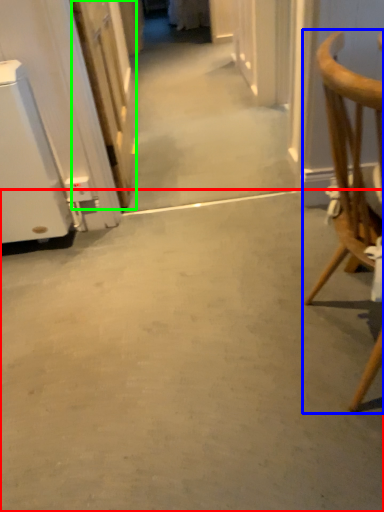
Question: Which object is positioned farthest from concrete (highlighted by a red box)? Select from chair (highlighted by a blue box) and door (highlighted by a green box).

Choices:
 (A) chair
 (B) door

Answer: (B)